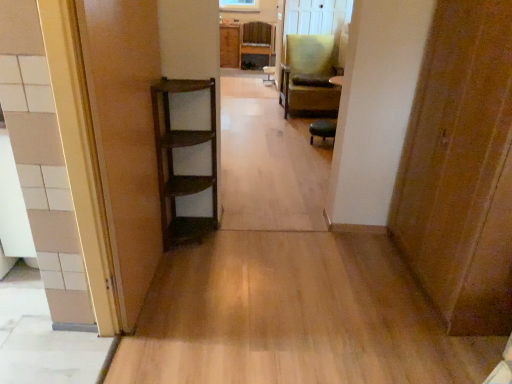
The image size is (512, 384). Describe the element at coordinates (309, 76) in the screenshot. I see `green fabric chair at center, the first chair from the right` at that location.

What do you see at coordinates (229, 46) in the screenshot?
I see `wooden cabinet at center` at bounding box center [229, 46].

Describe the element at coordinates (257, 40) in the screenshot. I see `wooden chair at center, acting as the 1th chair starting from the left` at that location.

Locate an element on the screen. The height and width of the screenshot is (384, 512). wooden door at left, the second door positioned from the right is located at coordinates click(x=123, y=139).

Locate an element on the screen. This screenshot has width=512, height=384. green fabric chair at center, the first chair from the right is located at coordinates (309, 76).

Is point (138, 110) farther from viewer compared to point (322, 122)?

No, (138, 110) is in front of (322, 122).

Based on their positions, is wooden door at left, the 1th door from the left, located to the left or right of green leather ottoman at center?

Clearly, wooden door at left, the 1th door from the left, is on the left of green leather ottoman at center in the image.

Is wooden door at left, the second door positioned from the right, looking in the opposite direction of green leather ottoman at center?

No.

Is wooden door at left, the 1th door from the left, surrounding green leather ottoman at center?

No, green leather ottoman at center is not a part of wooden door at left, the 1th door from the left.

Is there a large distance between green fabric chair at center, the 2th chair in the top-to-bottom sequence, and wooden door at right, the 2th door viewed from the left?

Absolutely, green fabric chair at center, the 2th chair in the top-to-bottom sequence, is distant from wooden door at right, the 2th door viewed from the left.

From a real-world perspective, does green fabric chair at center, acting as the second chair starting from the back, stand above wooden door at right, which is the first door in right-to-left order?

No.

Which object is wider, green fabric chair at center, the first chair viewed from the front, or wooden door at right, which is the first door in right-to-left order?

green fabric chair at center, the first chair viewed from the front.

From the image's perspective, is green fabric chair at center, acting as the second chair starting from the back, on top of wooden door at right, which is the first door in right-to-left order?

Yes, from the image's perspective, green fabric chair at center, acting as the second chair starting from the back, is over wooden door at right, which is the first door in right-to-left order.

From a real-world perspective, is wooden cabinet at center located higher than green fabric chair at center, the 2th chair in the top-to-bottom sequence?

Incorrect, from a real-world perspective, wooden cabinet at center is lower than green fabric chair at center, the 2th chair in the top-to-bottom sequence.

Considering the positions of points (229, 35) and (311, 72), is point (229, 35) farther from camera compared to point (311, 72)?

Yes.

Is green fabric chair at center, the first chair ordered from the bottom, a part of wooden cabinet at center?

No.

How much distance is there between wooden cabinet at center and green fabric chair at center, the first chair viewed from the front?

wooden cabinet at center is 10.68 feet away from green fabric chair at center, the first chair viewed from the front.

From a real-world perspective, is green leather ottoman at center positioned under wooden cabinet at center based on gravity?

Yes.

Who is more distant, green leather ottoman at center or wooden cabinet at center?

Positioned behind is wooden cabinet at center.

Can you tell me how much green leather ottoman at center and wooden cabinet at center differ in facing direction?

They differ by 89.1 degrees in their facing directions.

Which is farther from the camera, (326, 129) or (239, 58)?

The point (239, 58) is farther from the camera.

Is wooden cabinet at center wider than green leather ottoman at center?

Yes, wooden cabinet at center is wider than green leather ottoman at center.

Is wooden cabinet at center facing away from green leather ottoman at center?

wooden cabinet at center is not turned away from green leather ottoman at center.

Which is more to the left, wooden cabinet at center or green leather ottoman at center?

wooden cabinet at center is more to the left.

Which object is closer to the camera, wooden cabinet at center or green leather ottoman at center?

green leather ottoman at center is closer to the camera.

Does wooden door at right, the 2th door viewed from the left, have a lesser width compared to wooden chair at center, acting as the 1th chair starting from the left?

In fact, wooden door at right, the 2th door viewed from the left, might be wider than wooden chair at center, acting as the 1th chair starting from the left.

At what (x,y) coordinates should I click in order to perform the action: click on door that is the 1st one when counting forward from the wooden chair at center, which appears as the second chair when ordered from the bottom. Please return your answer as a coordinate pair (x, y). The height and width of the screenshot is (384, 512). Looking at the image, I should click on (461, 169).

Between wooden door at right, the 2th door viewed from the left, and wooden chair at center, which is the 1th chair from back to front, which one has smaller size?

wooden chair at center, which is the 1th chair from back to front, is smaller.

Is wooden chair at center, placed as the 2th chair when sorted from front to back, inside wooden door at right, which is the first door in right-to-left order?

Definitely not — wooden chair at center, placed as the 2th chair when sorted from front to back, is not inside wooden door at right, which is the first door in right-to-left order.

From a real-world perspective, between wooden door at right, the 2th door viewed from the left, and wooden door at left, the 1th door from the left, who is vertically higher?

wooden door at right, the 2th door viewed from the left.

Is wooden door at right, the 2th door viewed from the left, facing away from wooden door at left, the second door positioned from the right?

No, wooden door at right, the 2th door viewed from the left, is not facing the opposite direction of wooden door at left, the second door positioned from the right.

Considering the relative sizes of wooden door at right, the 2th door viewed from the left, and wooden door at left, the second door positioned from the right, in the image provided, is wooden door at right, the 2th door viewed from the left, taller than wooden door at left, the second door positioned from the right,?

Indeed, wooden door at right, the 2th door viewed from the left, has a greater height compared to wooden door at left, the second door positioned from the right.

From the image's perspective, is wooden door at right, which is the first door in right-to-left order, located above or below wooden door at left, the 1th door from the left?

wooden door at right, which is the first door in right-to-left order, is situated lower than wooden door at left, the 1th door from the left, in the image.

Find the location of `the 1st door above the green leather ottoman at center (from a real-world perspective)`. the 1st door above the green leather ottoman at center (from a real-world perspective) is located at coordinates (123, 139).

Starting from the wooden door at right, the 2th door viewed from the left, which chair is the 1st one to the left? Please provide its 2D coordinates.

[(309, 76)]

Based on the photo, considering their positions, is green fabric chair at center, acting as the second chair starting from the back, positioned closer to green leather ottoman at center than wooden door at left, the second door positioned from the right?

Among the two, green fabric chair at center, acting as the second chair starting from the back, is located nearer to green leather ottoman at center.

Looking at the image, which one is located closer to wooden cabinet at center, wooden door at left, the second door positioned from the right, or green fabric chair at center, the first chair ordered from the bottom?

The object closer to wooden cabinet at center is green fabric chair at center, the first chair ordered from the bottom.

When comparing their distances from green fabric chair at center, the first chair ordered from the bottom, does wooden door at left, the second door positioned from the right, or wooden cabinet at center seem further?

Among the two, wooden door at left, the second door positioned from the right, is located further to green fabric chair at center, the first chair ordered from the bottom.

Looking at this image, which object lies nearer to the anchor point green leather ottoman at center, wooden chair at center, which appears as the second chair when ordered from the bottom, or wooden door at left, the 1th door from the left?

wooden door at left, the 1th door from the left.

Which object lies nearer to the anchor point wooden door at right, the 2th door viewed from the left, wooden cabinet at center or wooden chair at center, positioned as the second chair in right-to-left order?

Among the two, wooden chair at center, positioned as the second chair in right-to-left order, is located nearer to wooden door at right, the 2th door viewed from the left.

When comparing their distances from wooden chair at center, acting as the 1th chair starting from the left, does wooden cabinet at center or wooden door at right, the 2th door viewed from the left, seem closer?

wooden cabinet at center.

Which object lies further to the anchor point green leather ottoman at center, wooden cabinet at center or green fabric chair at center, the 2th chair in the top-to-bottom sequence?

wooden cabinet at center is positioned further to the anchor green leather ottoman at center.

Based on their spatial positions, is wooden chair at center, acting as the 1th chair starting from the left, or green leather ottoman at center further from green fabric chair at center, acting as the second chair starting from the left?

Based on the image, wooden chair at center, acting as the 1th chair starting from the left, appears to be further to green fabric chair at center, acting as the second chair starting from the left.

Identify the location of furniture between wooden door at right, the 2th door viewed from the left, and wooden chair at center, which appears as the second chair when ordered from the bottom, from front to back. This screenshot has height=384, width=512. (322, 129).

Where is `furniture between wooden door at right, which is the first door in right-to-left order, and wooden cabinet at center, along the z-axis`? This screenshot has height=384, width=512. furniture between wooden door at right, which is the first door in right-to-left order, and wooden cabinet at center, along the z-axis is located at coordinates (322, 129).

You are a GUI agent. You are given a task and a screenshot of the screen. Output one action in this format:
    pyautogui.click(x=<x>, y=<y>)
    Task: Click on the furniture located between wooden door at left, the 1th door from the left, and wooden chair at center, arranged as the first chair when viewed from the top, in the depth direction
    This screenshot has width=512, height=384.
    Given the screenshot: What is the action you would take?
    pyautogui.click(x=322, y=129)

Locate an element on the screen. This screenshot has width=512, height=384. furniture positioned between wooden door at left, the 1th door from the left, and wooden cabinet at center from near to far is located at coordinates (322, 129).